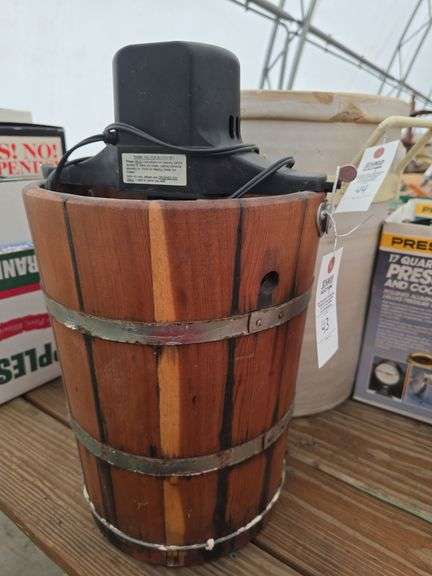
At what (x,y) coordinates should I click in order to perform the action: click on box. Please return your answer as a coordinate pair (x, y). The image size is (432, 576). Looking at the image, I should click on (415, 325).